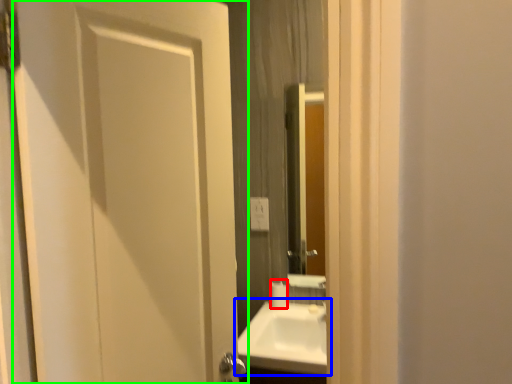
Question: Considering the real-world distances, which object is closest to toilet paper (highlighted by a red box)? sink (highlighted by a blue box) or door (highlighted by a green box).

Choices:
 (A) sink
 (B) door

Answer: (A)